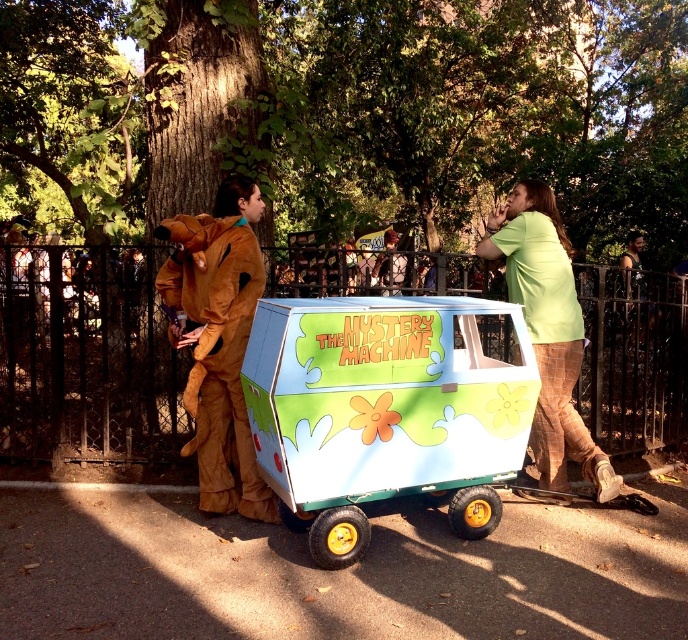
You are standing in the outdoor scene and want to place a small flag at the point labeled point (387, 410). Where exactly should you place it?

The point (387, 410) is located on the green painted wood mystery machine at center, so place the flag there.

You are standing in the outdoor scene with the Mystery Machine wagon. There is a point marked at coordinates (217,339). What object is located at that point?

The point at coordinates (217,339) indicates the brown furry costume at center.

You are standing in the outdoor scene and want to take a photo of both the green painted wood mystery machine at center and the green plaid pants at right. Which object should you focus on first to ensure both are in clear view?

You should focus on the green painted wood mystery machine at center first because it is closer to you than the green plaid pants at right. By focusing on the closer object, the depth of field may allow both to be in focus, especially if using a small aperture or a wide angle lens.